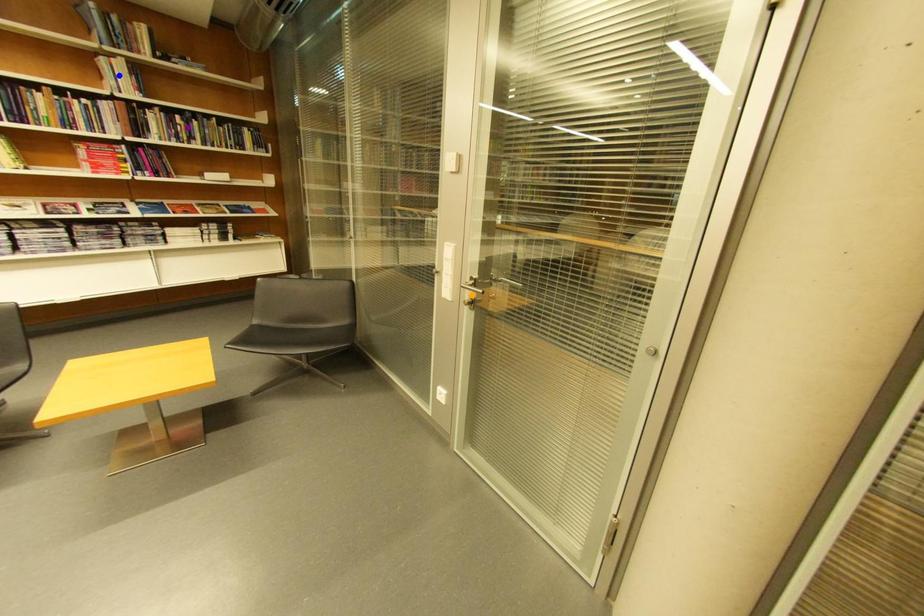
Order these from farthest to nearest:
- purple point
- blue point
- orange point

purple point < blue point < orange point